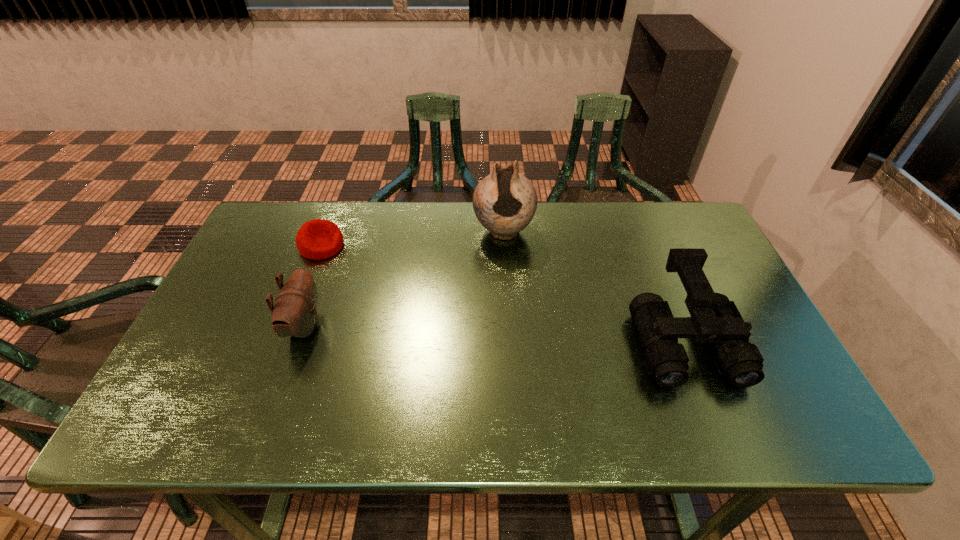
Identify the location of the second shortest object. This screenshot has width=960, height=540. (295, 313).

This screenshot has height=540, width=960. I want to click on the second tallest object, so click(714, 318).

Where is `binoculars`? The height and width of the screenshot is (540, 960). binoculars is located at coordinates (714, 318).

The height and width of the screenshot is (540, 960). What are the coordinates of `pottery` in the screenshot? It's located at (505, 201).

The height and width of the screenshot is (540, 960). Find the location of `the tallest object`. the tallest object is located at coordinates (505, 201).

Find the location of a particular element. The width and height of the screenshot is (960, 540). beanbag is located at coordinates (317, 239).

Image resolution: width=960 pixels, height=540 pixels. What are the coordinates of `vacant space located 0.350m with the flap open on the third tallest object` in the screenshot? It's located at (461, 326).

Find the location of `free space located from the spout of the third object from left to right`. free space located from the spout of the third object from left to right is located at coordinates (503, 281).

Where is `vacant position located from the spout of the third object from left to right`? Image resolution: width=960 pixels, height=540 pixels. vacant position located from the spout of the third object from left to right is located at coordinates (502, 345).

Find the location of a particular element. free space located from the spout of the third object from left to right is located at coordinates (503, 329).